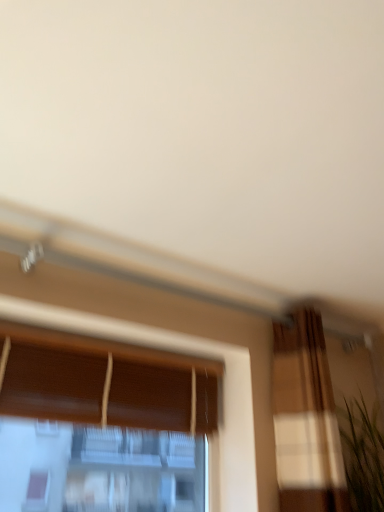
Question: Would you say green matte plant at right is outside brown wood window at center?

Choices:
 (A) yes
 (B) no

Answer: (A)

Question: Does green matte plant at right come behind brown wood window at center?

Choices:
 (A) yes
 (B) no

Answer: (A)

Question: Is green matte plant at right to the right of brown wood window at center from the viewer's perspective?

Choices:
 (A) no
 (B) yes

Answer: (B)

Question: Considering the relative positions of green matte plant at right and brown wood window at center in the image provided, is green matte plant at right to the left of brown wood window at center from the viewer's perspective?

Choices:
 (A) no
 (B) yes

Answer: (A)

Question: Can you confirm if green matte plant at right is thinner than brown wood window at center?

Choices:
 (A) no
 (B) yes

Answer: (A)

Question: Can you see green matte plant at right touching brown wood window at center?

Choices:
 (A) yes
 (B) no

Answer: (B)

Question: Considering the relative sizes of brown wood window at center and green matte plant at right in the image provided, is brown wood window at center thinner than green matte plant at right?

Choices:
 (A) yes
 (B) no

Answer: (A)

Question: Does brown wood window at center lie behind green matte plant at right?

Choices:
 (A) yes
 (B) no

Answer: (B)

Question: Is brown wood window at center positioned in front of green matte plant at right?

Choices:
 (A) no
 (B) yes

Answer: (B)

Question: Does brown wood window at center have a lesser height compared to green matte plant at right?

Choices:
 (A) no
 (B) yes

Answer: (A)

Question: Is brown wood window at center taller than green matte plant at right?

Choices:
 (A) no
 (B) yes

Answer: (B)

Question: From the image's perspective, is brown wood window at center located beneath green matte plant at right?

Choices:
 (A) yes
 (B) no

Answer: (B)

Question: Is brown wood window at center wider or thinner than green matte plant at right?

Choices:
 (A) wide
 (B) thin

Answer: (B)